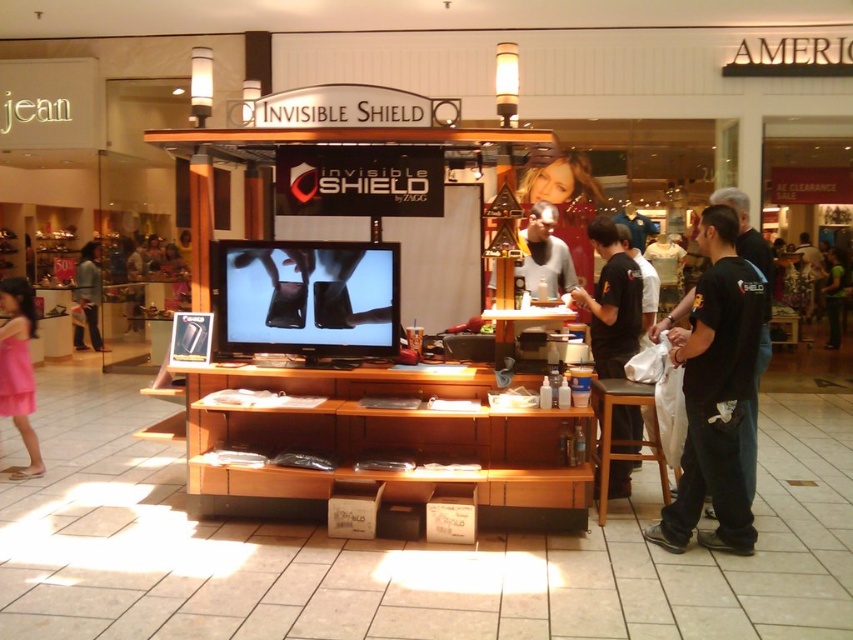
Question: Considering the real-world distances, which object is farthest from the pink satin dress at lower left?

Choices:
 (A) black cotton t-shirt at right
 (B) black cotton shirt at right
 (C) matte black shirt at center

Answer: (A)

Question: Which object appears closest to the camera in this image?

Choices:
 (A) black cotton t-shirt at right
 (B) pink satin dress at lower left
 (C) black cotton shirt at right

Answer: (C)

Question: Which object is closer to the camera taking this photo?

Choices:
 (A) black cotton t-shirt at right
 (B) matte black shirt at center
 (C) pink satin dress at lower left
 (D) black cotton shirt at right

Answer: (D)

Question: Does pink satin dress at lower left appear over brown wooden stool at lower right?

Choices:
 (A) no
 (B) yes

Answer: (B)

Question: From the image, what is the correct spatial relationship of black cotton shirt at right in relation to black matte shirt at right?

Choices:
 (A) right
 (B) left

Answer: (A)

Question: Considering the relative positions of black matte shirt at right and black cotton t-shirt at right in the image provided, where is black matte shirt at right located with respect to black cotton t-shirt at right?

Choices:
 (A) right
 (B) left

Answer: (B)